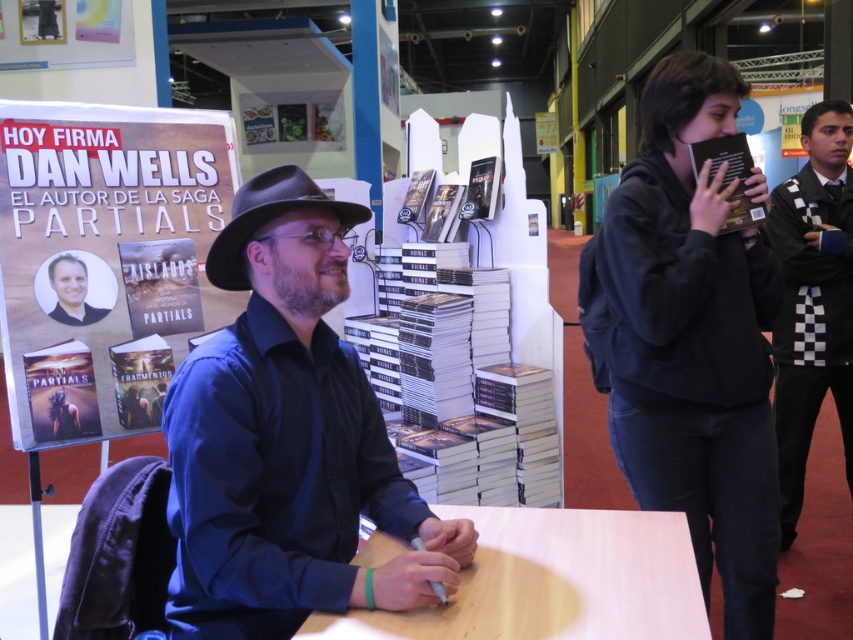
Does point (727, 486) lie in front of point (848, 221)?

Yes, it is.

Where is `black hoodie at upper right`? This screenshot has width=853, height=640. black hoodie at upper right is located at coordinates (689, 340).

Does matte paper poster at upper left appear under checkered fabric scarf at right?

Incorrect, matte paper poster at upper left is not positioned below checkered fabric scarf at right.

Locate an element on the screen. This screenshot has width=853, height=640. matte paper poster at upper left is located at coordinates (105, 260).

Where is `matte paper poster at upper left`? This screenshot has width=853, height=640. matte paper poster at upper left is located at coordinates (105, 260).

Can you confirm if checkered fabric scarf at right is smaller than gray felt fedora at center?

Incorrect, checkered fabric scarf at right is not smaller in size than gray felt fedora at center.

Does checkered fabric scarf at right have a greater width compared to gray felt fedora at center?

Yes, checkered fabric scarf at right is wider than gray felt fedora at center.

I want to click on checkered fabric scarf at right, so click(811, 300).